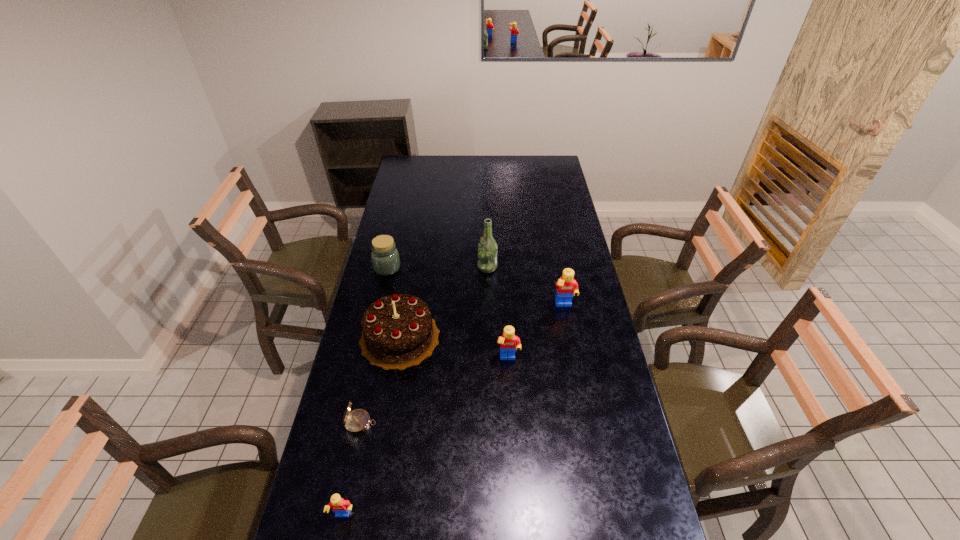
If we want them evenly spaced by inserting an extra Lego among them, please locate a free spot for this new Lego. Please provide its 2D coordinates. Your answer should be formatted as a tuple, i.e. [(x, y)], where the tuple contains the x and y coordinates of a point satisfying the conditions above.

[(437, 427)]